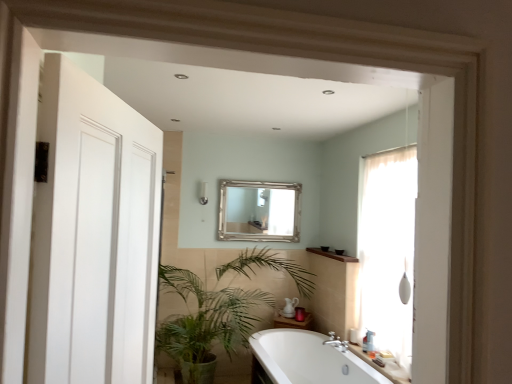
Question: Does white glossy bathtub at center have a larger size compared to white plastic bottle at lower right?

Choices:
 (A) yes
 (B) no

Answer: (A)

Question: Can you confirm if white glossy bathtub at center is shorter than white plastic bottle at lower right?

Choices:
 (A) yes
 (B) no

Answer: (B)

Question: Is white glossy bathtub at center at the left side of white plastic bottle at lower right?

Choices:
 (A) no
 (B) yes

Answer: (B)

Question: Is white plastic bottle at lower right completely or partially inside white glossy bathtub at center?

Choices:
 (A) yes
 (B) no

Answer: (B)

Question: Is white glossy bathtub at center positioned in front of white plastic bottle at lower right?

Choices:
 (A) no
 (B) yes

Answer: (B)

Question: Is white glossy bathtub at center beside white plastic bottle at lower right?

Choices:
 (A) yes
 (B) no

Answer: (B)

Question: Is white glossy counter top at lower right looking in the opposite direction of green leafy plant at lower left?

Choices:
 (A) yes
 (B) no

Answer: (B)

Question: Are white glossy counter top at lower right and green leafy plant at lower left located far from each other?

Choices:
 (A) yes
 (B) no

Answer: (A)

Question: Is white glossy counter top at lower right to the left of green leafy plant at lower left from the viewer's perspective?

Choices:
 (A) yes
 (B) no

Answer: (B)

Question: Does white glossy counter top at lower right have a lesser width compared to green leafy plant at lower left?

Choices:
 (A) yes
 (B) no

Answer: (A)

Question: Could you tell me if white glossy counter top at lower right is turned towards green leafy plant at lower left?

Choices:
 (A) yes
 (B) no

Answer: (B)

Question: Is white glossy counter top at lower right outside green leafy plant at lower left?

Choices:
 (A) no
 (B) yes

Answer: (B)

Question: From the image's perspective, is silver metallic mirror at upper center under white plastic bottle at lower right?

Choices:
 (A) yes
 (B) no

Answer: (B)